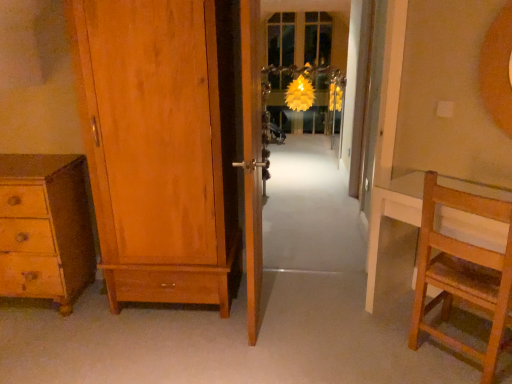
Locate an element on the screen. This screenshot has width=512, height=384. vacant space that is to the left of light brown wooden chair at right is located at coordinates (378, 347).